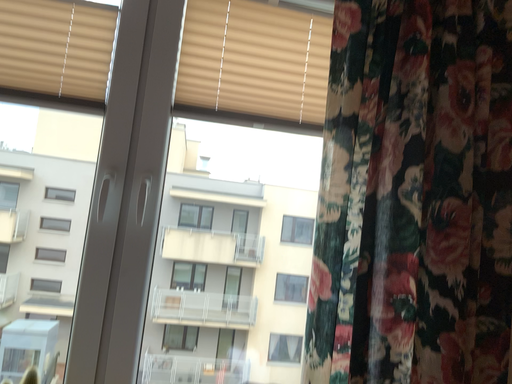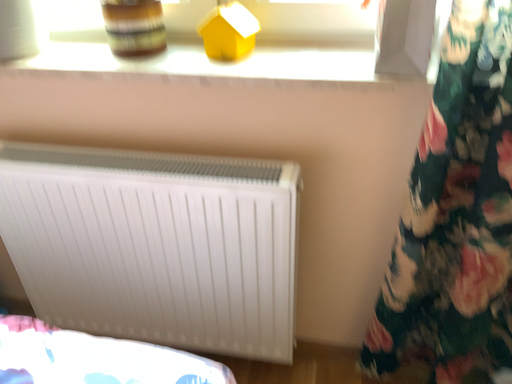
Question: How did the camera likely rotate when shooting the video?

Choices:
 (A) rotated right
 (B) rotated left

Answer: (B)